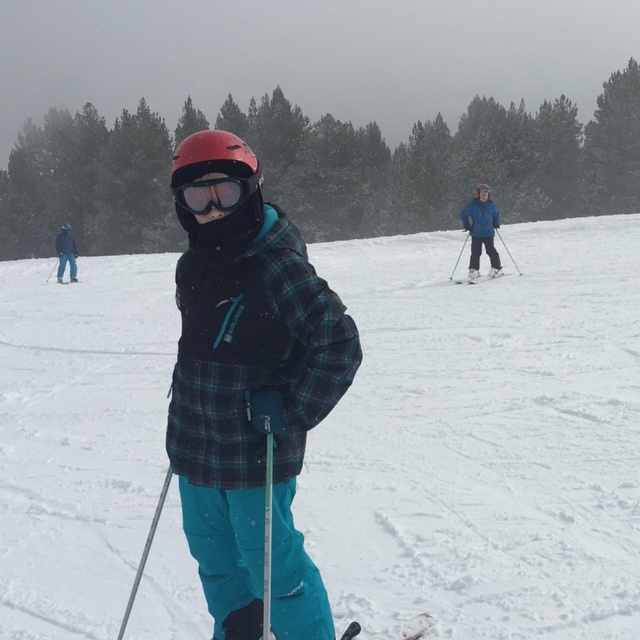
You are a skier standing on the slope and see the point marked at coordinates (419, 628). What object is located at that point?

The black plastic ski at lower center is located at point (419, 628).

You are a photographer standing at the top of the slope. You want to take a photo of the plaid jacket at center and the black plastic ski at lower center so that both are visible in the frame. Which object should you adjust your camera angle to focus on first to ensure both are in the shot?

The plaid jacket at center is positioned on the left side of the black plastic ski at lower center, so you should focus on the plaid jacket at center first to ensure both are in the frame.